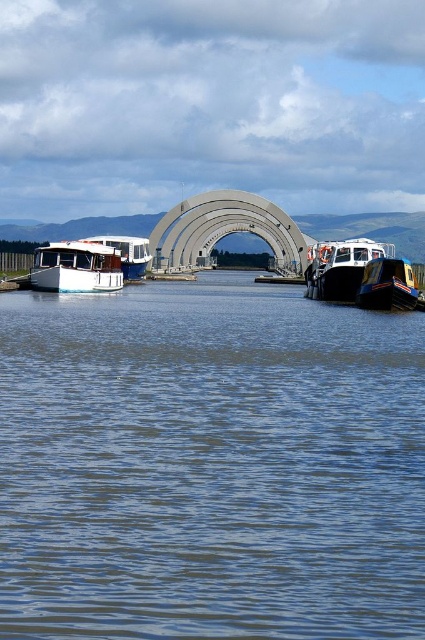
Question: Which of the following is the farthest from the observer?

Choices:
 (A) (388, 266)
 (B) (161, 228)
 (C) (65, 260)

Answer: (B)

Question: Which of these objects is positioned closest to the blue glossy boat at lower right?

Choices:
 (A) white matte boat at left
 (B) blue water at center
 (C) white glossy barge at right
 (D) white glossy boat at left

Answer: (C)

Question: From the image, what is the correct spatial relationship of blue glossy boat at lower right in relation to white glossy boat at left?

Choices:
 (A) right
 (B) left

Answer: (A)

Question: Does blue water at center appear on the right side of concrete bridge at center?

Choices:
 (A) no
 (B) yes

Answer: (B)

Question: Can you confirm if white matte boat at left is positioned to the left of white glossy boat at left?

Choices:
 (A) yes
 (B) no

Answer: (B)

Question: Among these points, which one is farthest from the camera?

Choices:
 (A) (99, 252)
 (B) (350, 296)
 (C) (363, 282)
 (D) (115, 237)

Answer: (D)